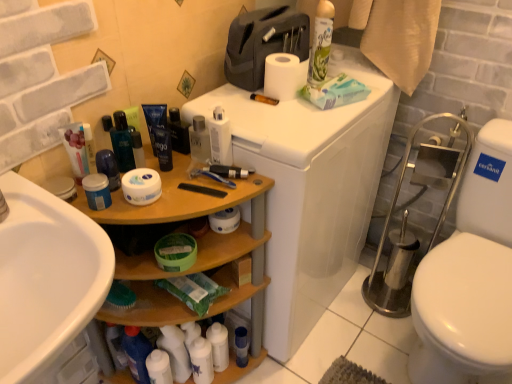
Image resolution: width=512 pixels, height=384 pixels. I want to click on vacant point to the right of white glossy bottle at lower center, which is the tenth toiletry from left to right, so click(273, 369).